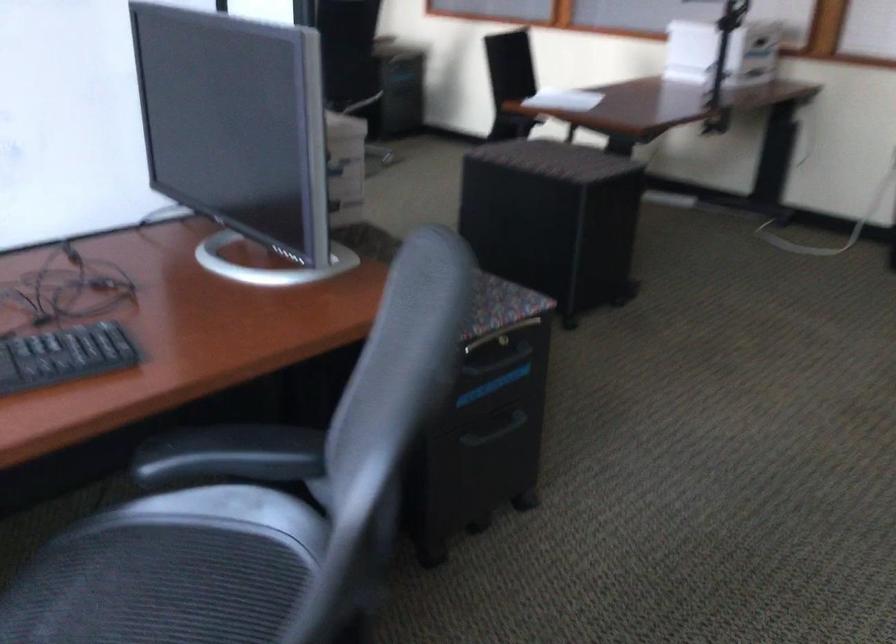
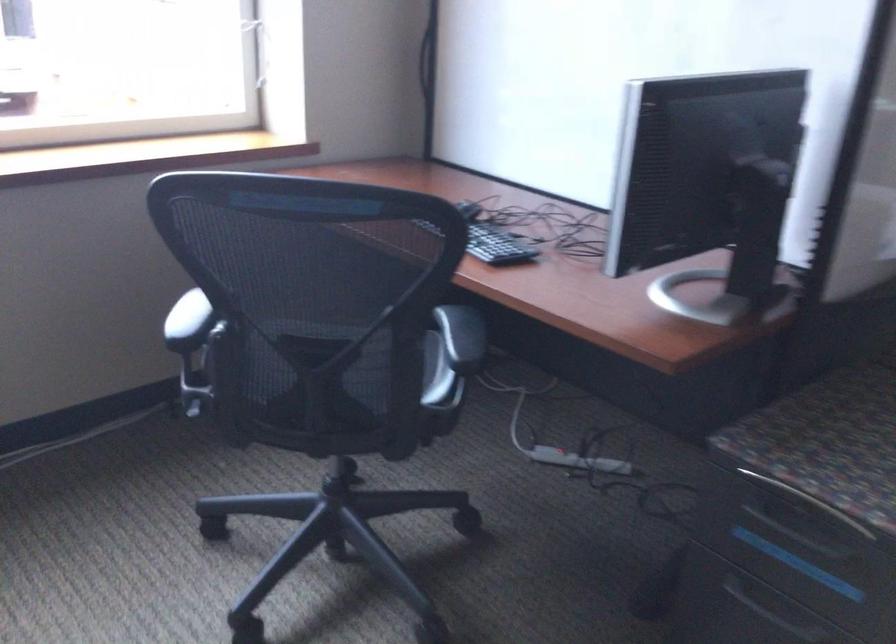
Locate, in the second image, the point that corresponds to the point at 506,361 in the first image.

(800, 536)